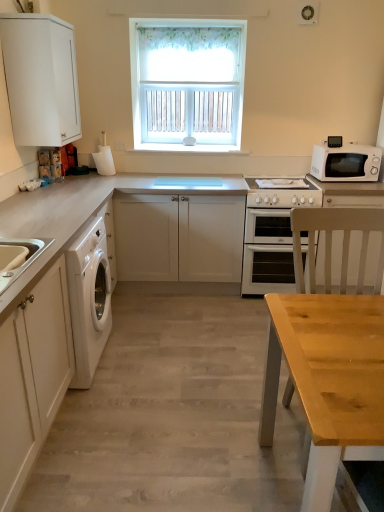
Question: From a real-world perspective, is white wooden window at upper center above or below white matte washing machine at left?

Choices:
 (A) below
 (B) above

Answer: (B)

Question: Is white wooden window at upper center spatially inside white matte washing machine at left, or outside of it?

Choices:
 (A) inside
 (B) outside

Answer: (B)

Question: Which object is the closest to the white glossy oven at center?

Choices:
 (A) white matte microwave at right
 (B) wooden table at center
 (C) white glossy gas stove at center
 (D) white ceramic sink at lower left
 (E) white wooden window at upper center

Answer: (C)

Question: Considering the real-world distances, which object is closest to the white wooden window at upper center?

Choices:
 (A) white ceramic sink at lower left
 (B) white matte cabinet at upper left, the second cabinetry viewed from the front
 (C) white glossy gas stove at center
 (D) wooden table at center
 (E) white matte cabinet at center, which is the 1th cabinetry in back-to-front order

Answer: (C)